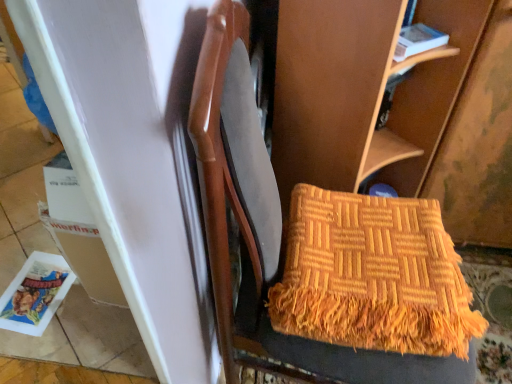
Question: From the image's perspective, is orange woven blanket at center under white paper magazine at upper right, which ranks as the first magazine in right-to-left order?

Choices:
 (A) yes
 (B) no

Answer: (A)

Question: Is orange woven blanket at center oriented away from white paper magazine at upper right, arranged as the first magazine when viewed from the top?

Choices:
 (A) no
 (B) yes

Answer: (A)

Question: From a real-world perspective, does orange woven blanket at center stand above white paper magazine at upper right, which appears as the 2th magazine when viewed from the left?

Choices:
 (A) no
 (B) yes

Answer: (A)

Question: Is orange woven blanket at center at the right side of white paper magazine at upper right, which ranks as the first magazine in right-to-left order?

Choices:
 (A) no
 (B) yes

Answer: (A)

Question: Would you consider orange woven blanket at center to be distant from white paper magazine at upper right, placed as the 2th magazine when sorted from bottom to top?

Choices:
 (A) no
 (B) yes

Answer: (A)

Question: Considering the relative sizes of orange woven blanket at center and white paper magazine at upper right, which appears as the 2th magazine when viewed from the left, in the image provided, is orange woven blanket at center shorter than white paper magazine at upper right, which appears as the 2th magazine when viewed from the left,?

Choices:
 (A) no
 (B) yes

Answer: (A)

Question: From the image's perspective, is matte plastic magazine at lower left, which is the 1th magazine in bottom-to-top order, on top of white paper magazine at upper right, arranged as the first magazine when viewed from the top?

Choices:
 (A) yes
 (B) no

Answer: (B)

Question: Is matte plastic magazine at lower left, the 2th magazine in the front-to-back sequence, facing towards white paper magazine at upper right, the 1th magazine viewed from the front?

Choices:
 (A) yes
 (B) no

Answer: (B)

Question: Considering the relative positions of matte plastic magazine at lower left, which appears as the first magazine when viewed from the back, and white paper magazine at upper right, placed as the second magazine when sorted from back to front, in the image provided, is matte plastic magazine at lower left, which appears as the first magazine when viewed from the back, to the right of white paper magazine at upper right, placed as the second magazine when sorted from back to front, from the viewer's perspective?

Choices:
 (A) yes
 (B) no

Answer: (B)

Question: Is matte plastic magazine at lower left, the first magazine positioned from the left, further to the viewer compared to white paper magazine at upper right, the 1th magazine viewed from the front?

Choices:
 (A) yes
 (B) no

Answer: (A)

Question: Is matte plastic magazine at lower left, which is counted as the second magazine, starting from the top, far from white paper magazine at upper right, placed as the 2th magazine when sorted from bottom to top?

Choices:
 (A) no
 (B) yes

Answer: (B)

Question: Is matte plastic magazine at lower left, the first magazine positioned from the left, at the left side of white paper magazine at upper right, which ranks as the first magazine in right-to-left order?

Choices:
 (A) yes
 (B) no

Answer: (A)

Question: Can you confirm if white paper magazine at upper right, placed as the 2th magazine when sorted from bottom to top, is thinner than orange woven blanket at center?

Choices:
 (A) no
 (B) yes

Answer: (B)